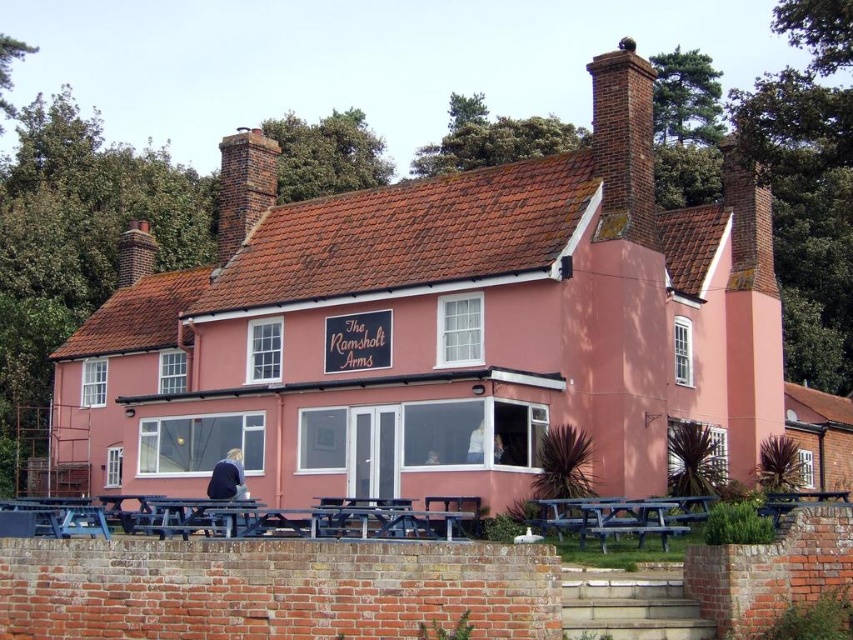
Can you confirm if brick chimney at upper center is bigger than brown brick chimney at upper left?

Yes.

Between brick chimney at upper center and brown brick chimney at upper left, which one appears on the left side from the viewer's perspective?

Positioned to the left is brown brick chimney at upper left.

Between point (274, 202) and point (120, 232), which one is positioned in front?

Point (274, 202) is in front.

Image resolution: width=853 pixels, height=640 pixels. I want to click on brick chimney at upper center, so click(242, 186).